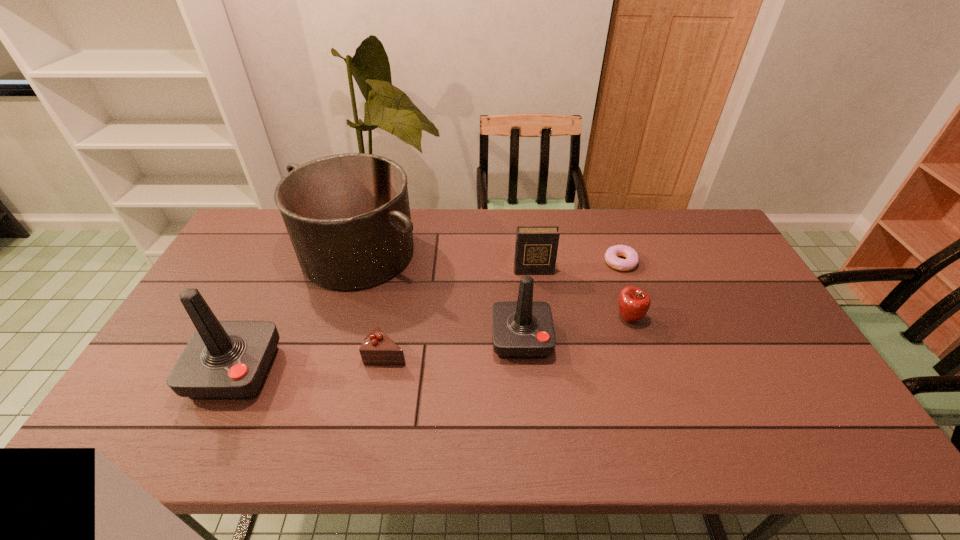
This screenshot has height=540, width=960. What are the coordinates of `the taller joystick` in the screenshot? It's located at (224, 360).

Identify the location of the right joystick. (523, 329).

The height and width of the screenshot is (540, 960). I want to click on the shorter joystick, so click(523, 329).

At what (x,y) coordinates should I click in order to perform the action: click on pan. Please return your answer as a coordinate pair (x, y). The width and height of the screenshot is (960, 540). Looking at the image, I should click on (348, 217).

Image resolution: width=960 pixels, height=540 pixels. In order to click on the fourth tallest object in this screenshot , I will do `click(536, 247)`.

The width and height of the screenshot is (960, 540). In order to click on the third shortest object in this screenshot , I will do `click(634, 303)`.

Find the location of a particular element. The image size is (960, 540). doughnut is located at coordinates (632, 259).

This screenshot has width=960, height=540. What are the coordinates of `the sixth tallest object` in the screenshot? It's located at (x=377, y=348).

What are the coordinates of `blank space located 0.120m on the right of the left joystick` in the screenshot? It's located at (322, 372).

Identify the location of vacant space located 0.060m on the right of the right joystick. (572, 339).